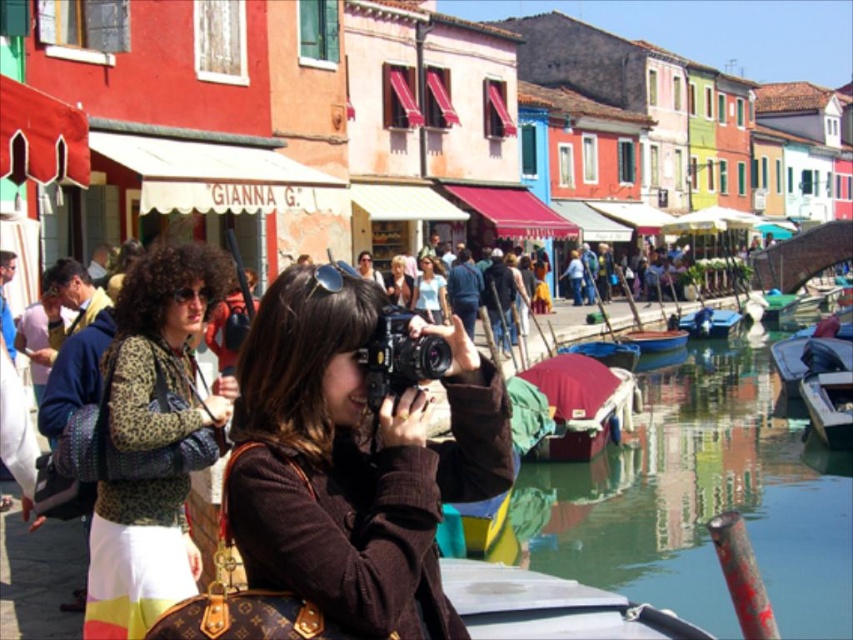
Between green fabric boat at center and blonde hair at center, which one appears on the left side from the viewer's perspective?

Positioned to the left is blonde hair at center.

Between green fabric boat at center and blonde hair at center, which one is positioned lower?

green fabric boat at center is below.

Locate an element on the screen. The image size is (853, 640). green fabric boat at center is located at coordinates (606, 353).

At what (x,y) coordinates should I click in order to perform the action: click on green fabric boat at center. Please return your answer as a coordinate pair (x, y). The image size is (853, 640). Looking at the image, I should click on (606, 353).

Can you confirm if blue painted wooden boat at center is positioned to the right of blonde hair at center?

Yes, blue painted wooden boat at center is to the right of blonde hair at center.

This screenshot has height=640, width=853. What do you see at coordinates (654, 339) in the screenshot? I see `blue painted wooden boat at center` at bounding box center [654, 339].

Find the location of a particular element. blue painted wooden boat at center is located at coordinates (654, 339).

Between leopard print sweater at center and black plastic camera at center, which one has less height?

Standing shorter between the two is black plastic camera at center.

Is leopard print sweater at center closer to the viewer compared to black plastic camera at center?

No, it is not.

Who is more forward, (186, 570) or (410, 353)?

Positioned in front is point (410, 353).

I want to click on leopard print sweater at center, so click(x=164, y=346).